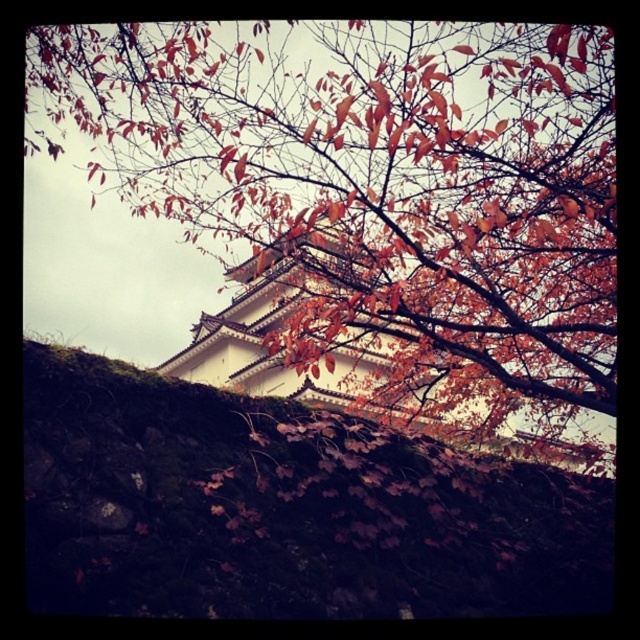
You are standing in front of the traditional Japanese building and notice the autumn leaves at upper center and the mossy stone wall at lower center. Which object is closer to you?

The autumn leaves at upper center are closer to you because they are positioned further to the viewer than the mossy stone wall at lower center.